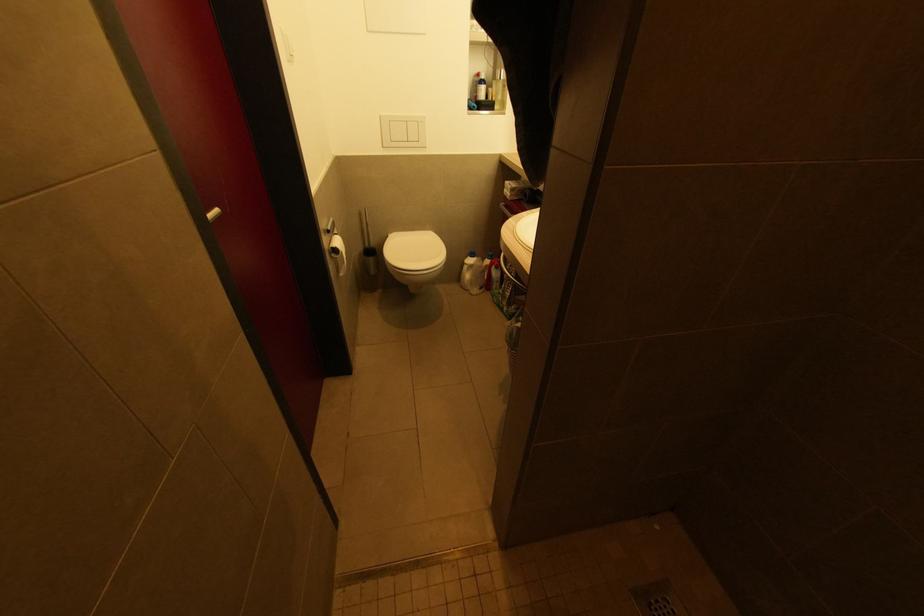
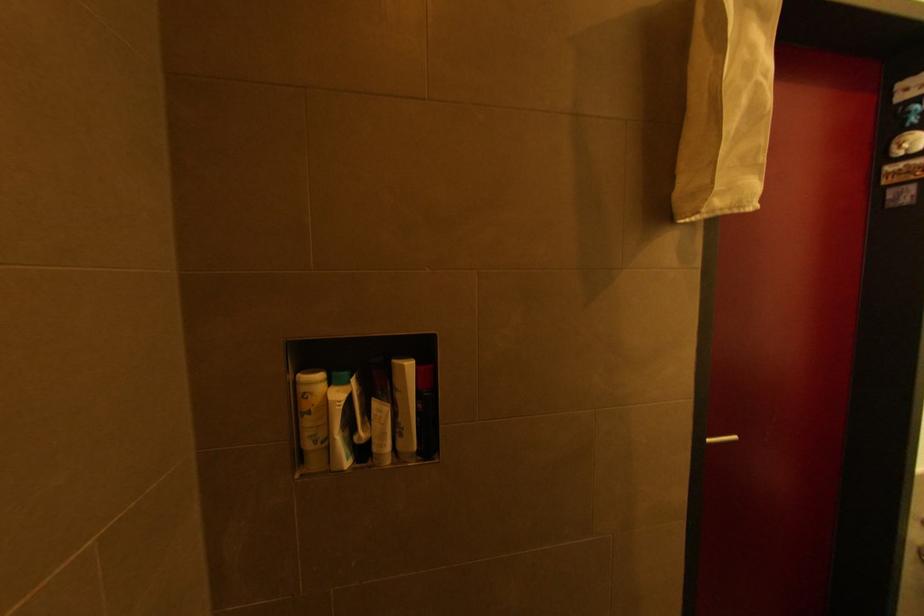
Question: The camera is either moving clockwise (left) or counter-clockwise (right) around the object. The first image is from the beginning of the video and the second image is from the end. Is the camera moving left or right when shooting the video?

Choices:
 (A) Left
 (B) Right

Answer: (B)